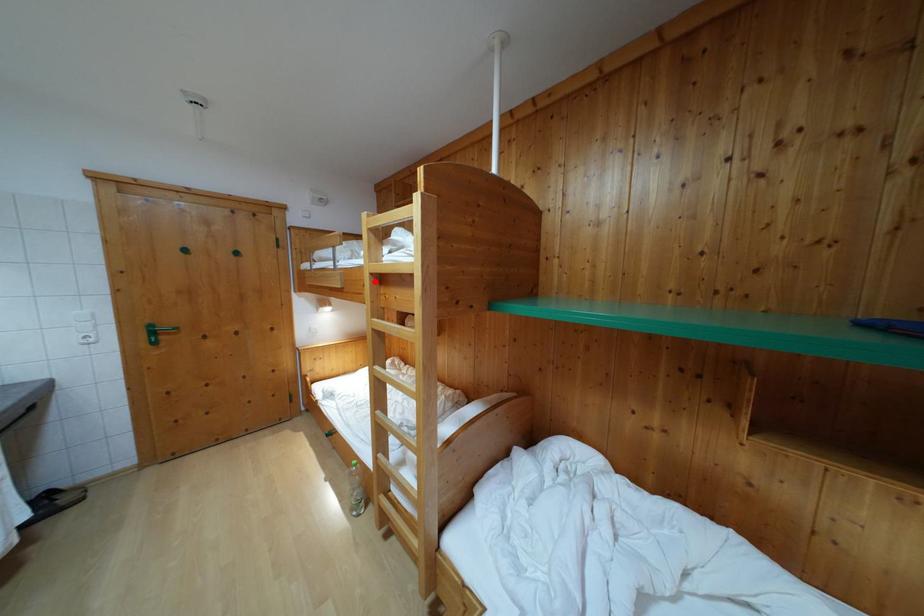
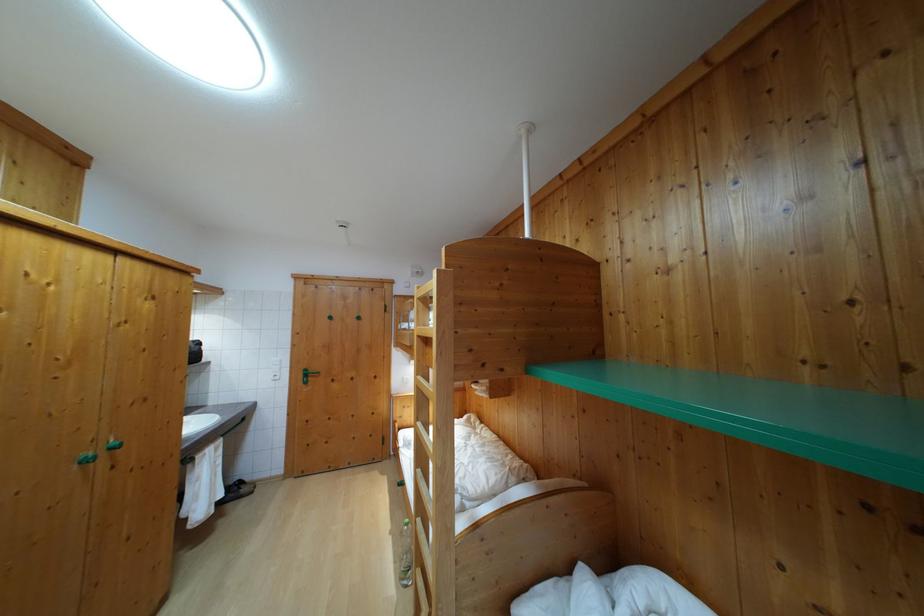
Locate, in the second image, the point that corresponds to the highlighted location in the first image.

(421, 342)